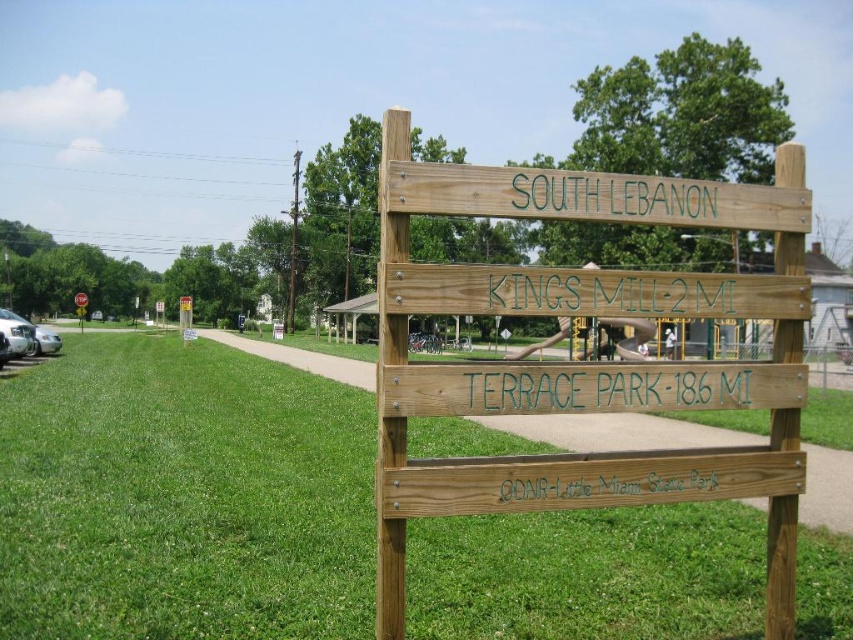
Question: Estimate the real-world distances between objects in this image. Which object is farther from the green wood sign at upper center?

Choices:
 (A) green painted wood sign at center
 (B) metallic yellow stop sign at upper left

Answer: (B)

Question: Is green wood sign at upper center behind metallic yellow stop sign at upper left?

Choices:
 (A) yes
 (B) no

Answer: (B)

Question: Can you confirm if green painted sign at center is positioned below green wood sign at upper center?

Choices:
 (A) yes
 (B) no

Answer: (A)

Question: In this image, where is green painted sign at center located relative to metallic yellow stop sign at upper left?

Choices:
 (A) left
 (B) right

Answer: (B)

Question: Considering the real-world distances, which object is farthest from the green wood sign at upper center?

Choices:
 (A) metallic yellow stop sign at upper left
 (B) green painted sign at center

Answer: (A)

Question: Which point is farther to the camera?

Choices:
 (A) (676, 195)
 (B) (254, 564)
 (C) (85, 307)

Answer: (C)